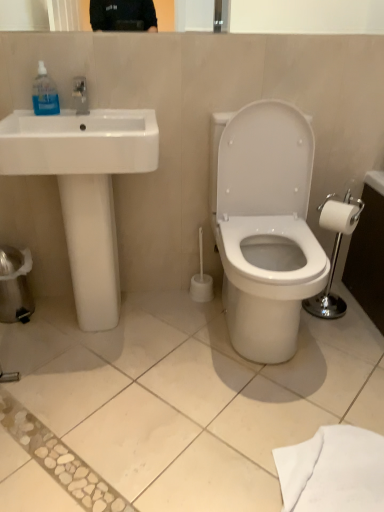
Question: Would you consider white glossy sink at left to be distant from white matte toilet paper at right?

Choices:
 (A) no
 (B) yes

Answer: (A)

Question: Does white glossy sink at left come in front of white matte toilet paper at right?

Choices:
 (A) no
 (B) yes

Answer: (B)

Question: Is white matte toilet paper at right at the back of white glossy sink at left?

Choices:
 (A) no
 (B) yes

Answer: (A)

Question: Could you tell me if white glossy sink at left is turned towards white matte toilet paper at right?

Choices:
 (A) no
 (B) yes

Answer: (A)

Question: Considering the relative sizes of white glossy sink at left and white matte toilet paper at right in the image provided, is white glossy sink at left smaller than white matte toilet paper at right?

Choices:
 (A) yes
 (B) no

Answer: (B)

Question: Is white glossy toilet at center situated inside white matte toilet paper at right or outside?

Choices:
 (A) inside
 (B) outside

Answer: (B)

Question: From a real-world perspective, is white glossy toilet at center positioned above or below white matte toilet paper at right?

Choices:
 (A) above
 (B) below

Answer: (B)

Question: Looking at their shapes, would you say white glossy toilet at center is wider or thinner than white matte toilet paper at right?

Choices:
 (A) thin
 (B) wide

Answer: (B)

Question: Relative to white matte toilet paper at right, is white glossy toilet at center in front or behind?

Choices:
 (A) behind
 (B) front

Answer: (B)

Question: Considering the relative positions of white glossy sink at left and white matte toilet paper at right in the image provided, is white glossy sink at left to the left or to the right of white matte toilet paper at right?

Choices:
 (A) right
 (B) left

Answer: (B)

Question: Considering the positions of white glossy sink at left and white matte toilet paper at right in the image, is white glossy sink at left wider or thinner than white matte toilet paper at right?

Choices:
 (A) wide
 (B) thin

Answer: (A)

Question: Considering the positions of point (107, 224) and point (354, 206), is point (107, 224) closer or farther from the camera than point (354, 206)?

Choices:
 (A) closer
 (B) farther

Answer: (A)

Question: Is white glossy sink at left bigger or smaller than white matte toilet paper at right?

Choices:
 (A) big
 (B) small

Answer: (A)

Question: Is point (334, 224) positioned closer to the camera than point (14, 115)?

Choices:
 (A) farther
 (B) closer

Answer: (A)

Question: Considering the relative positions of white matte toilet paper at right and white glossy sink at left in the image provided, is white matte toilet paper at right to the left or to the right of white glossy sink at left?

Choices:
 (A) right
 (B) left

Answer: (A)